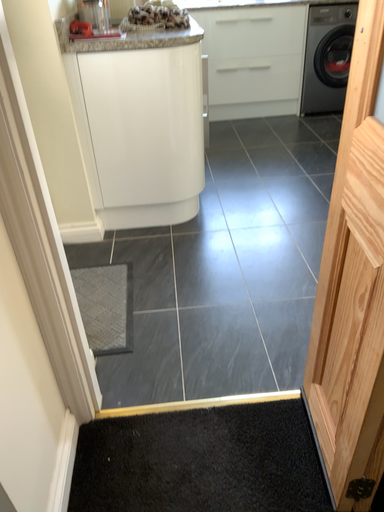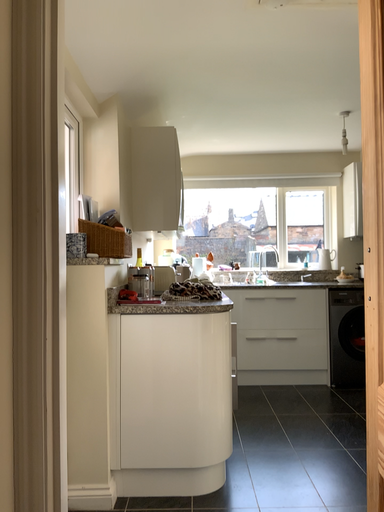
Question: Which way did the camera rotate in the video?

Choices:
 (A) rotated upward
 (B) rotated downward

Answer: (A)